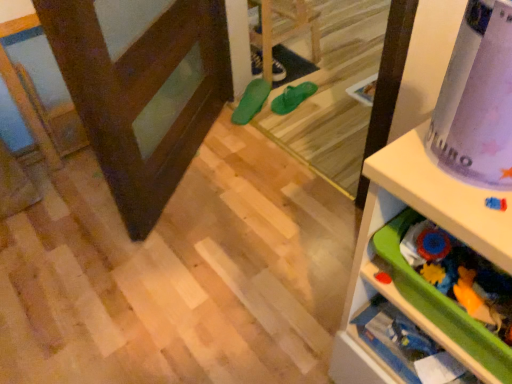
The image size is (512, 384). I want to click on vacant area that lies between green rubber shoe at center, which appears as the third footwear when viewed from the back, and green rubber flip-flops at center, which ranks as the 2th footwear in front-to-back order, so pyautogui.click(x=273, y=98).